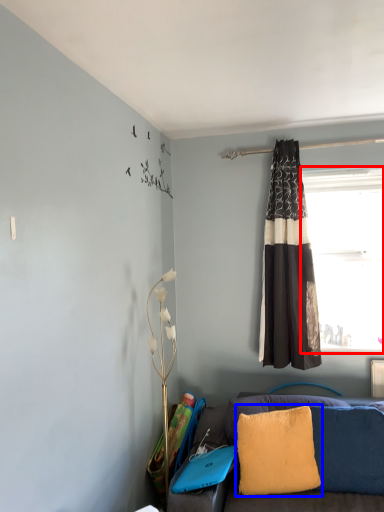
Question: Which of the following is the farthest to the observer, window (highlighted by a red box) or pillow (highlighted by a blue box)?

Choices:
 (A) window
 (B) pillow

Answer: (A)